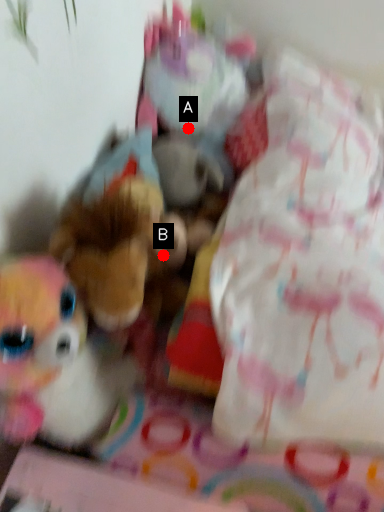
Question: Two points are circled on the image, labeled by A and B beside each circle. Which of the following is the closest to the observer?

Choices:
 (A) A is closer
 (B) B is closer

Answer: (B)